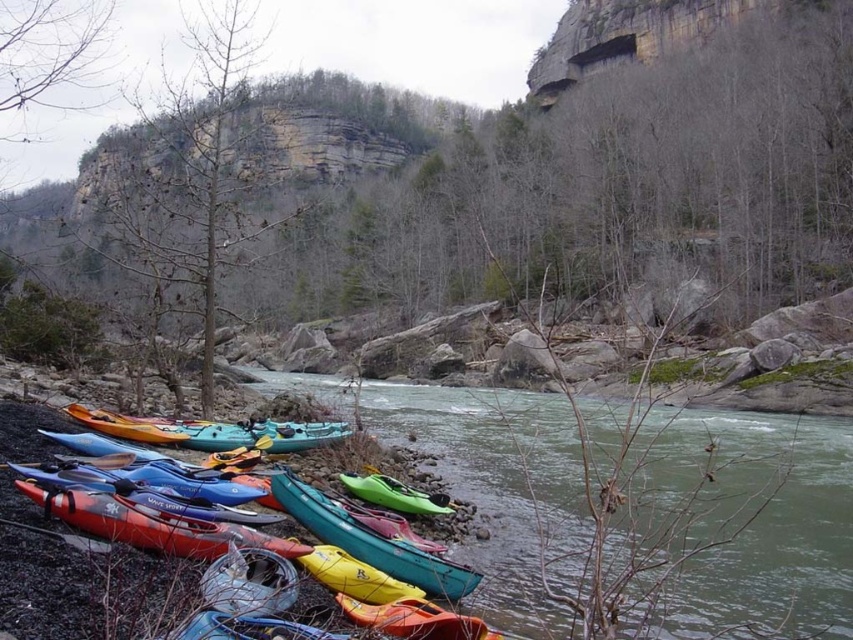
Question: Which point appears farthest from the camera in this image?

Choices:
 (A) (688, 492)
 (B) (111, 461)

Answer: (A)

Question: Is the position of matte blue kayak at lower left less distant than that of green matte kayak at center?

Choices:
 (A) yes
 (B) no

Answer: (A)

Question: Is blue plastic paddle at lower left below green matte kayak at lower center?

Choices:
 (A) no
 (B) yes

Answer: (A)

Question: Does blue plastic paddle at lower left have a lesser width compared to green matte kayak at lower center?

Choices:
 (A) yes
 (B) no

Answer: (B)

Question: Which of these objects is positioned farthest from the green matte kayak at lower center?

Choices:
 (A) matte blue kayak at lower left
 (B) yellow matte paddle at center
 (C) green matte kayak at center
 (D) blue plastic paddle at lower left

Answer: (A)

Question: Among these objects, which one is nearest to the camera?

Choices:
 (A) green matte kayak at center
 (B) blue plastic paddle at lower left
 (C) yellow matte paddle at center

Answer: (A)